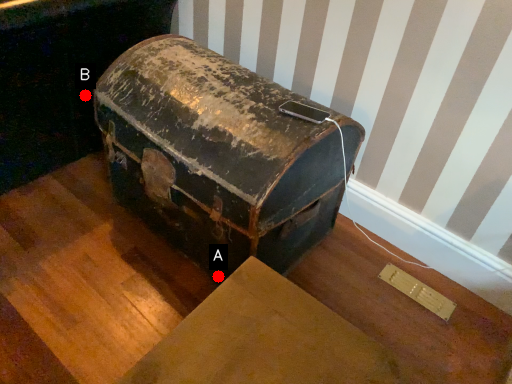
Question: Two points are circled on the image, labeled by A and B beside each circle. Among these points, which one is nearest to the camera?

Choices:
 (A) A is closer
 (B) B is closer

Answer: (A)